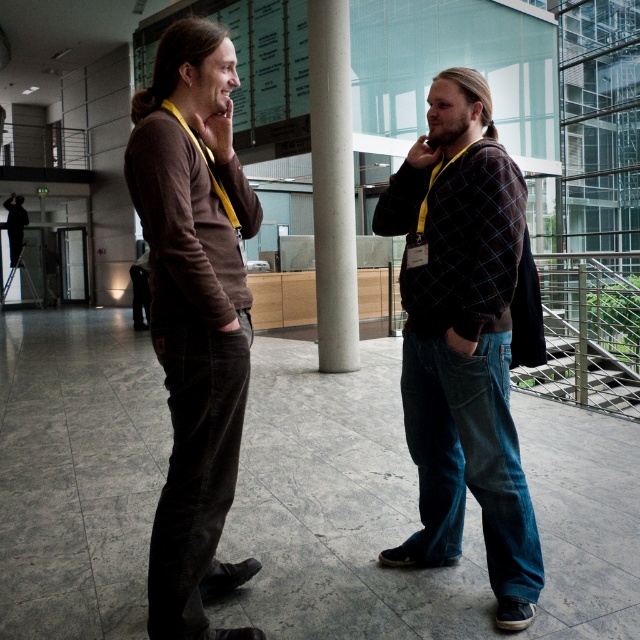
Who is shorter, dark blue jeans at center or white concrete pillar at center?

dark blue jeans at center is shorter.

Based on the photo, does dark blue jeans at center appear on the right side of white concrete pillar at center?

Correct, you'll find dark blue jeans at center to the right of white concrete pillar at center.

Between point (476, 454) and point (348, 13), which one is positioned in front?

Point (476, 454)

Locate an element on the screen. dark blue jeans at center is located at coordinates (461, 339).

Does dark blue jeans at center have a lesser height compared to brown corduroy pants at left?

Yes.

Does point (493, 481) come closer to viewer compared to point (237, 163)?

No, it is behind (237, 163).

Which is in front, point (388, 211) or point (196, 189)?

Point (196, 189) is in front.

You are a GUI agent. You are given a task and a screenshot of the screen. Output one action in this format:
    pyautogui.click(x=<x>, y=<y>)
    Task: Click on the dark blue jeans at center
    This screenshot has height=640, width=640.
    Given the screenshot: What is the action you would take?
    pyautogui.click(x=461, y=339)

Does brown corduroy pants at left come in front of white concrete pillar at center?

That is True.

Does brown corduroy pants at left have a greater height compared to white concrete pillar at center?

In fact, brown corduroy pants at left may be shorter than white concrete pillar at center.

Between point (237, 250) and point (328, 300), which one is positioned in front?

Point (237, 250) is more forward.

Image resolution: width=640 pixels, height=640 pixels. Find the location of `brown corduroy pants at left`. brown corduroy pants at left is located at coordinates (195, 314).